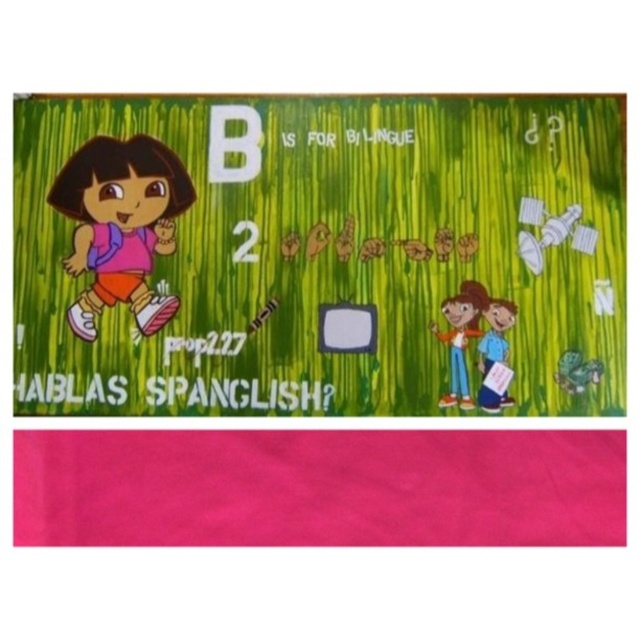
Question: Estimate the real-world distances between objects in this image. Which object is farther from the matte pink shorts at left?

Choices:
 (A) smooth blue pants at lower right
 (B) blue fabric shirt at lower right

Answer: (B)

Question: Is matte pink shorts at left wider than blue fabric shirt at lower right?

Choices:
 (A) yes
 (B) no

Answer: (A)

Question: Is smooth blue pants at lower right above blue fabric shirt at lower right?

Choices:
 (A) no
 (B) yes

Answer: (B)

Question: Is matte pink shorts at left thinner than blue fabric shirt at lower right?

Choices:
 (A) yes
 (B) no

Answer: (B)

Question: Among these points, which one is farthest from the camera?

Choices:
 (A) (502, 330)
 (B) (429, 326)

Answer: (B)

Question: Considering the real-world distances, which object is closest to the smooth blue pants at lower right?

Choices:
 (A) blue fabric shirt at lower right
 (B) matte pink shorts at left

Answer: (A)